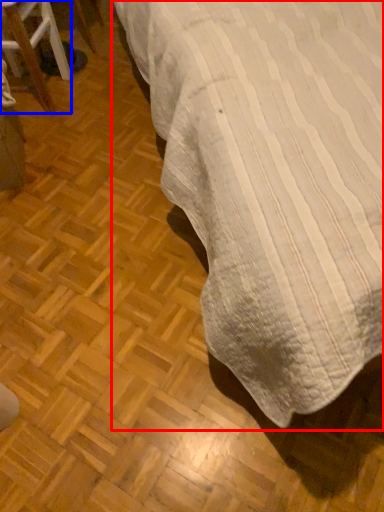
Question: Which object is further to the camera taking this photo, table (highlighted by a red box) or furniture (highlighted by a blue box)?

Choices:
 (A) table
 (B) furniture

Answer: (B)